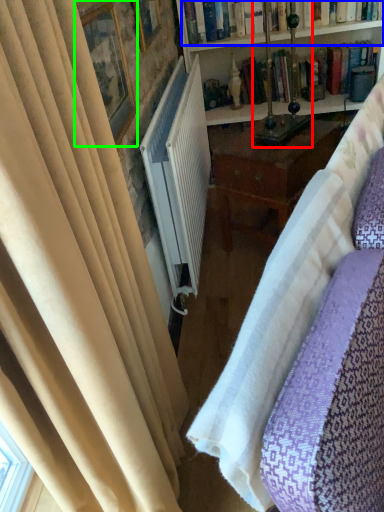
Question: Which object is positioned closest to table lamp (highlighted by a red box)? Select from book (highlighted by a blue box) and picture frame (highlighted by a green box).

Choices:
 (A) book
 (B) picture frame

Answer: (A)